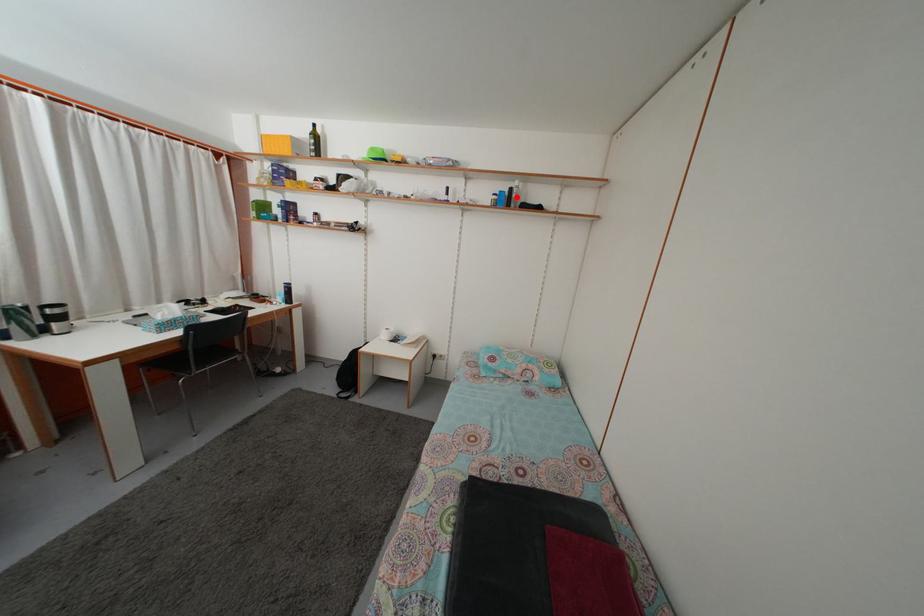
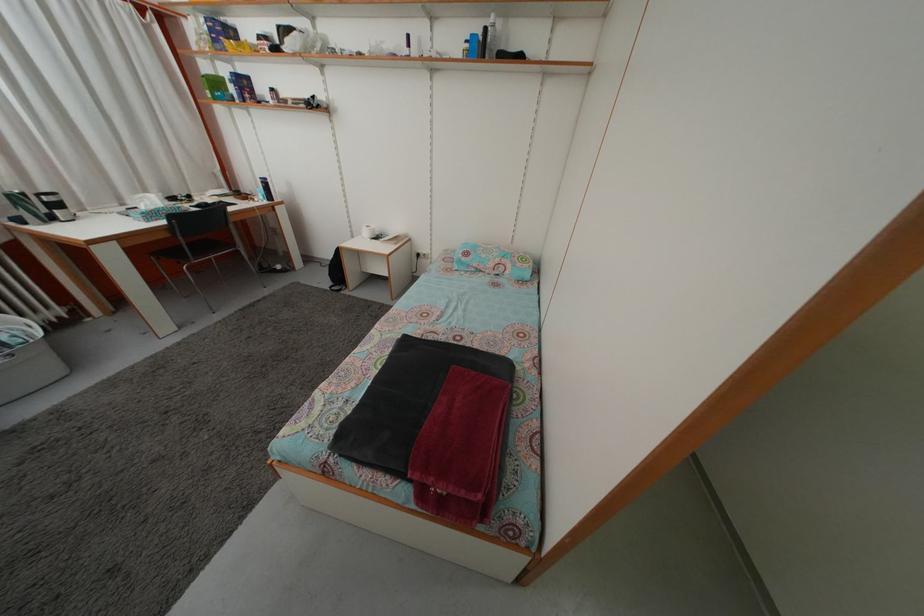
Where in the second image is the point corresponding to the highlighted location from the first image?

(492, 38)